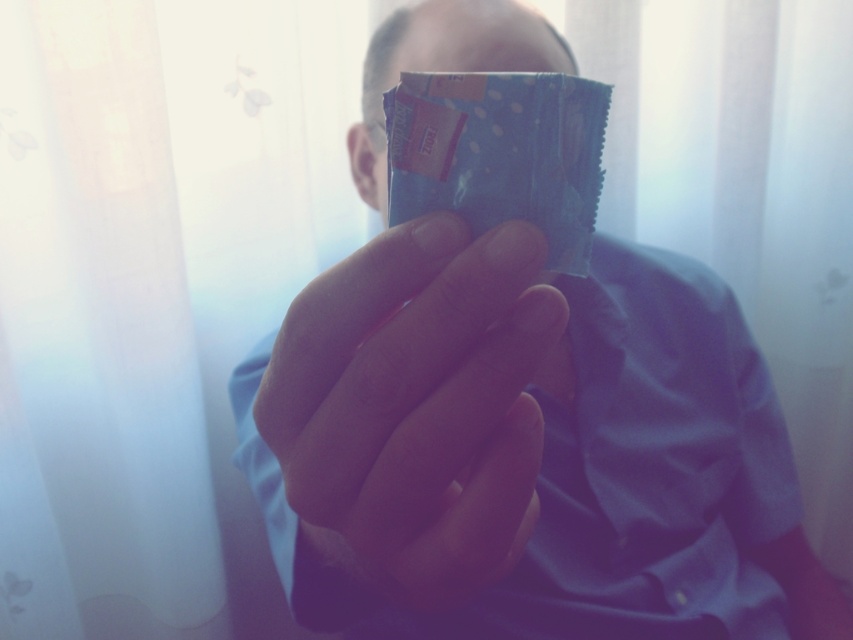
You are a photographer adjusting the focus of your camera. You need to ensure that both points, point (457,330) and point (490,134), are in focus. Given that your camera can only focus on objects at the same distance from the camera, which point should you prioritize focusing on to capture both points clearly?

Since point (457,330) is closer to the camera than point (490,134), you should prioritize focusing on point (457,330). This is because focusing on the closer point will allow the depth of field to extend backward, potentially covering both points more effectively than focusing on the farther point.

You are a photographer trying to capture the blue matte chocolate bar at center in focus while keeping the matte plastic packet at center slightly out of focus. Based on their positions, is this possible?

The matte plastic packet at center is closer to the viewer than the blue matte chocolate bar at center, so yes, you can focus on the blue matte chocolate bar at center while keeping the matte plastic packet at center slightly out of focus by adjusting the camera focus to the farther object.

You are trying to decide which item to take from the scene. The matte plastic packet at center and the blue matte chocolate bar at center are both in front of you. Which one can you pick up first if you reach out to grab the one that is physically closer to your hand?

The blue matte chocolate bar at center is closer to your hand since the matte plastic packet at center is larger in size but positioned further away.